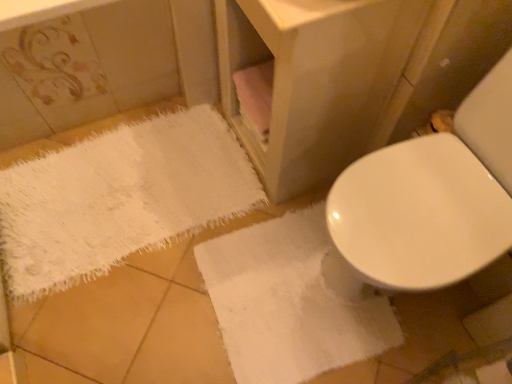
Question: Is the surface of white fluffy bath towel at lower left, the first bath towel positioned from the left, in direct contact with matte wood vanity at center?

Choices:
 (A) yes
 (B) no

Answer: (B)

Question: Is the position of white fluffy bath towel at lower left, the first bath towel positioned from the left, less distant than that of matte wood vanity at center?

Choices:
 (A) no
 (B) yes

Answer: (A)

Question: Is white fluffy bath towel at lower left, the 2th bath towel when ordered from right to left, aimed at matte wood vanity at center?

Choices:
 (A) yes
 (B) no

Answer: (B)

Question: Does white fluffy bath towel at lower left, the first bath towel positioned from the left, contain matte wood vanity at center?

Choices:
 (A) no
 (B) yes

Answer: (A)

Question: Does white fluffy bath towel at lower left, the 2th bath towel when ordered from right to left, appear on the right side of matte wood vanity at center?

Choices:
 (A) no
 (B) yes

Answer: (A)

Question: From the image's perspective, is white fluffy bath towel at lower left, the 2th bath towel when ordered from right to left, below matte wood vanity at center?

Choices:
 (A) yes
 (B) no

Answer: (A)

Question: Is white fluffy bath towel at lower right, which is the second bath towel in left-to-right order, at the left side of white fluffy bath towel at lower left, the 2th bath towel when ordered from right to left?

Choices:
 (A) no
 (B) yes

Answer: (A)

Question: From the image's perspective, is white fluffy bath towel at lower right, the first bath towel positioned from the right, over white fluffy bath towel at lower left, the first bath towel positioned from the left?

Choices:
 (A) no
 (B) yes

Answer: (A)

Question: Would you say white fluffy bath towel at lower right, which is the second bath towel in left-to-right order, contains white fluffy bath towel at lower left, the first bath towel positioned from the left?

Choices:
 (A) no
 (B) yes

Answer: (A)

Question: Is white fluffy bath towel at lower right, the first bath towel positioned from the right, looking in the opposite direction of white fluffy bath towel at lower left, the first bath towel positioned from the left?

Choices:
 (A) no
 (B) yes

Answer: (B)

Question: From a real-world perspective, is white fluffy bath towel at lower right, which is the second bath towel in left-to-right order, physically above white fluffy bath towel at lower left, the 2th bath towel when ordered from right to left?

Choices:
 (A) yes
 (B) no

Answer: (A)

Question: Considering the relative sizes of white fluffy bath towel at lower right, which is the second bath towel in left-to-right order, and white fluffy bath towel at lower left, the first bath towel positioned from the left, in the image provided, is white fluffy bath towel at lower right, which is the second bath towel in left-to-right order, thinner than white fluffy bath towel at lower left, the first bath towel positioned from the left,?

Choices:
 (A) yes
 (B) no

Answer: (A)

Question: Is white fluffy bath towel at lower right, which is the second bath towel in left-to-right order, shorter than matte wood vanity at center?

Choices:
 (A) yes
 (B) no

Answer: (A)